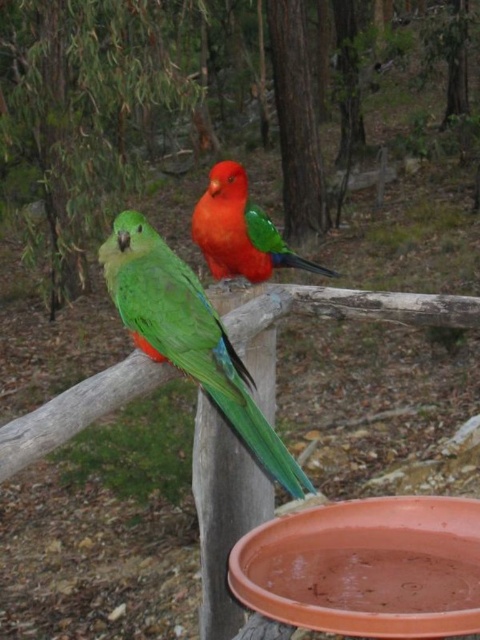
Question: Which of the following is the closest to the observer?

Choices:
 (A) green glossy parrot at left
 (B) shiny orange parrot at center

Answer: (A)

Question: From the image, what is the correct spatial relationship of green glossy parrot at left in relation to shiny orange parrot at center?

Choices:
 (A) above
 (B) below

Answer: (B)

Question: Where is green glossy parrot at left located in relation to shiny orange parrot at center in the image?

Choices:
 (A) below
 (B) above

Answer: (A)

Question: Can you confirm if green glossy parrot at left is smaller than shiny orange parrot at center?

Choices:
 (A) no
 (B) yes

Answer: (A)

Question: Which of the following is the farthest from the observer?

Choices:
 (A) (249, 220)
 (B) (250, 436)

Answer: (A)